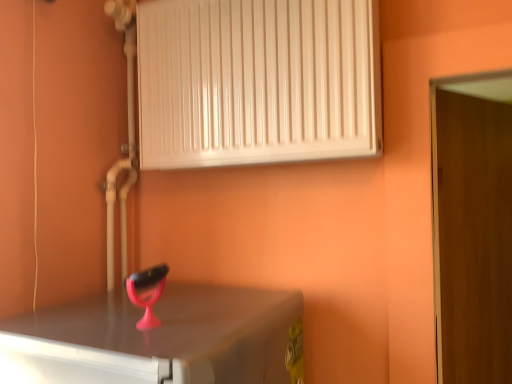
Question: From the image's perspective, relative to white glossy radiator at upper center, is wooden door at right above or below?

Choices:
 (A) below
 (B) above

Answer: (A)

Question: Is point (501, 77) positioned closer to the camera than point (252, 11)?

Choices:
 (A) farther
 (B) closer

Answer: (B)

Question: Which is correct: wooden door at right is inside white glossy radiator at upper center, or outside of it?

Choices:
 (A) inside
 (B) outside

Answer: (B)

Question: Is white glossy radiator at upper center taller or shorter than wooden door at right?

Choices:
 (A) short
 (B) tall

Answer: (A)

Question: In the image, is white glossy radiator at upper center positioned in front of or behind wooden door at right?

Choices:
 (A) front
 (B) behind

Answer: (A)

Question: In terms of width, does white glossy radiator at upper center look wider or thinner when compared to wooden door at right?

Choices:
 (A) thin
 (B) wide

Answer: (B)

Question: Is white glossy radiator at upper center inside the boundaries of wooden door at right, or outside?

Choices:
 (A) outside
 (B) inside

Answer: (A)